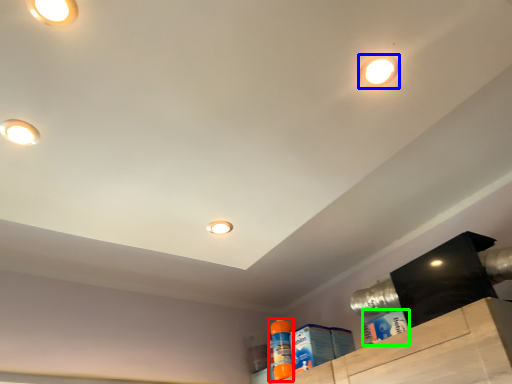
Question: Estimate the real-world distances between objects in this image. Which object is farther from cleaning product (highlighted by a red box), droplight (highlighted by a blue box) or cleaning product (highlighted by a green box)?

Choices:
 (A) droplight
 (B) cleaning product

Answer: (A)